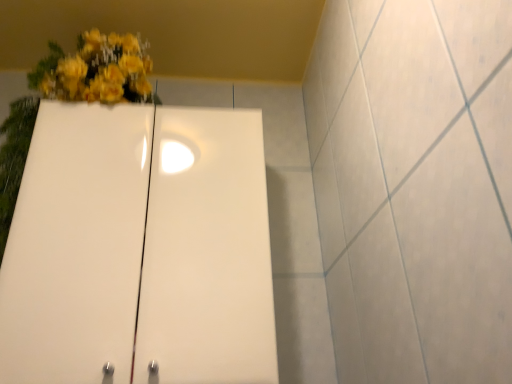
Find the location of a particular element. This screenshot has height=384, width=512. white glossy cabinet at upper left is located at coordinates (140, 249).

Describe the element at coordinates (140, 249) in the screenshot. The height and width of the screenshot is (384, 512). I see `white glossy cabinet at upper left` at that location.

Identify the location of white glossy cabinet at upper left. (x=140, y=249).